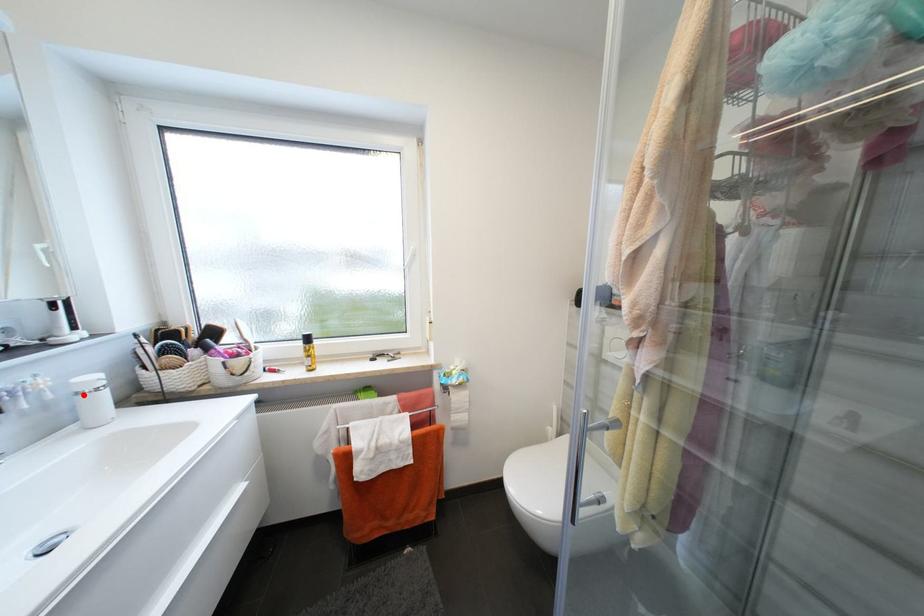
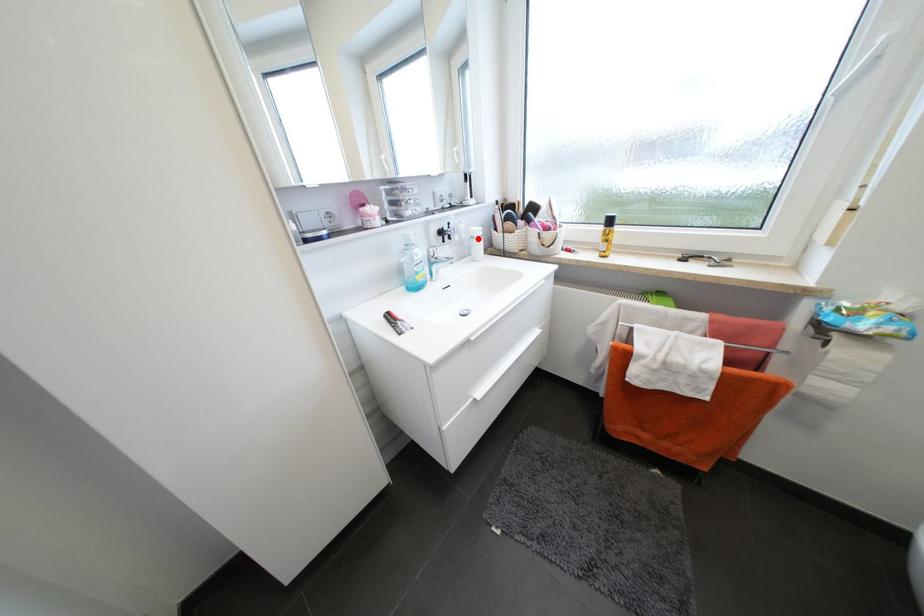
I am providing you with two images of the same scene from different viewpoints. A red point is marked on the first image and another point is marked on the second image. Is the red point in image1 aligned with the point shown in image2?

Yes